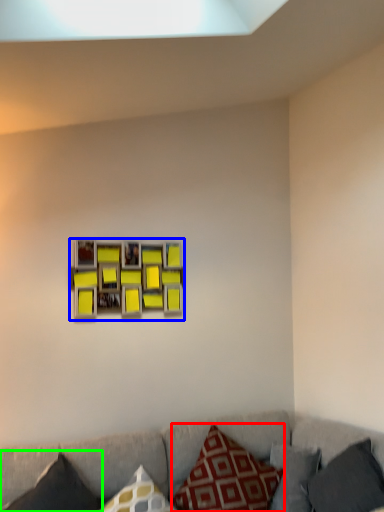
Question: Which object is the farthest from pillow (highlighted by a red box)? Choose among these: picture frame (highlighted by a blue box) or pillow (highlighted by a green box).

Choices:
 (A) picture frame
 (B) pillow

Answer: (A)